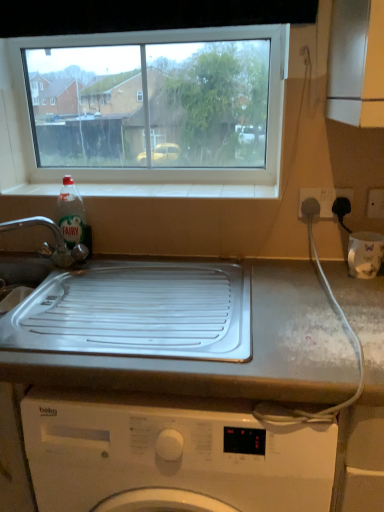
I want to click on free spot below brushed metal tap at left (from a real-world perspective), so [55, 281].